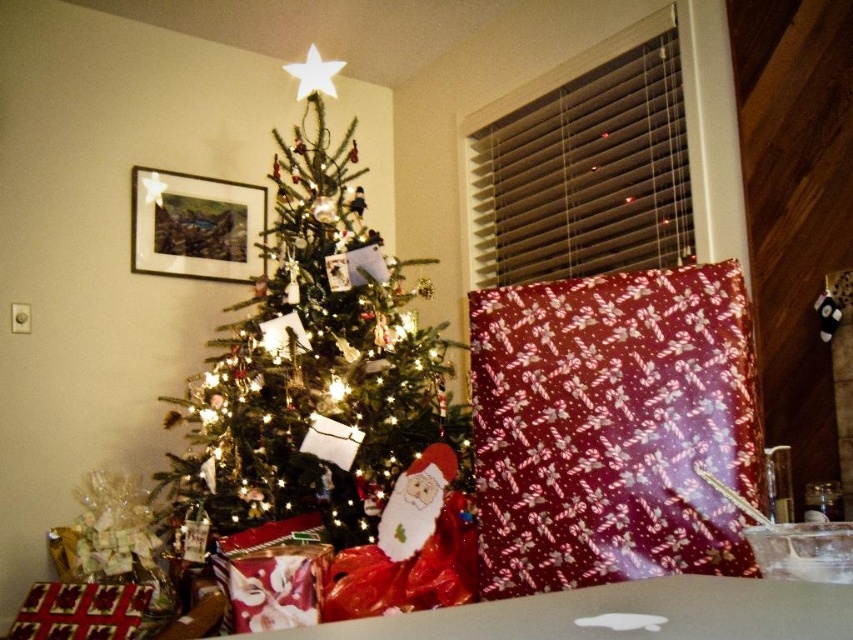
Looking at this image, you are standing in the room where the green matte christmas tree at center is located. If you face the tree and look directly ahead, which direction would the window with horizontal blinds be relative to the tree?

The window with horizontal blinds is to the right of the green matte christmas tree at center.

You are a child trying to place a small gift under the Christmas tree. You see the candy cane patterned paper at center and the felt santa claus at center. Which object should you place the gift on top of to ensure it stays visible?

The candy cane patterned paper at center is larger in size than the felt santa claus at center, so placing the gift on the candy cane patterned paper at center would ensure it stays visible.

You are standing in front of the Christmas tree and want to reach both the point at coordinates point (262, 492) and the point at coordinates point (381, 516). Which point will you need to move closer to the camera to reach first?

You will reach point (262, 492) first because it is closer to you than point (381, 516), which is further away.